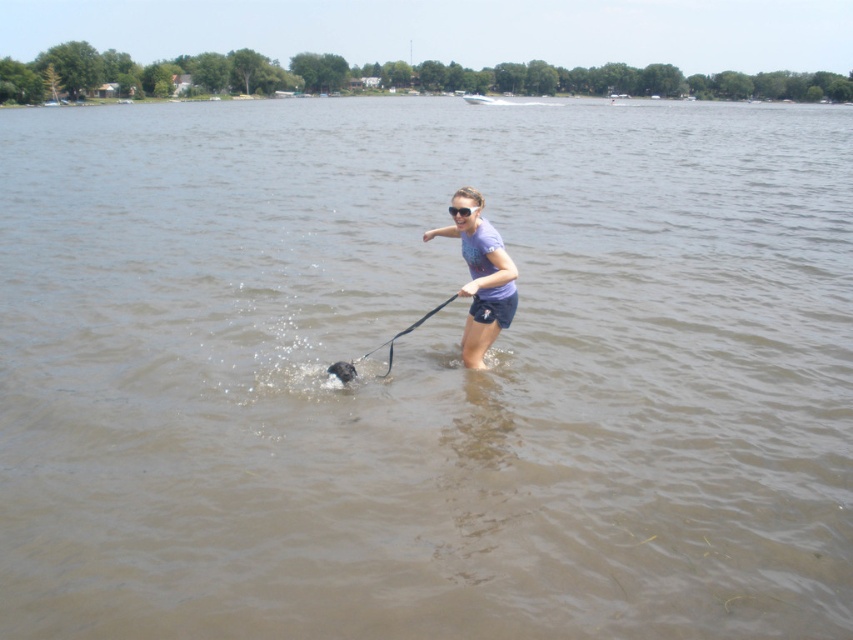
You are a photographer trying to capture the shiny black dog at center and the transparent plastic goggles at center in the same frame. Since the dog is smaller, which object should you zoom in on to ensure both fit in the photo?

Since the shiny black dog at center is smaller than the transparent plastic goggles at center, you should zoom in on the transparent plastic goggles at center to ensure both objects fit within the frame.